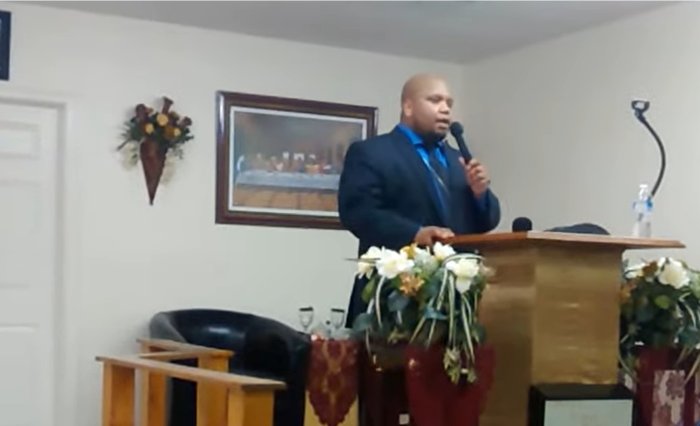
Image resolution: width=700 pixels, height=426 pixels. Find the location of `walls`. walls is located at coordinates (185, 226), (556, 177).